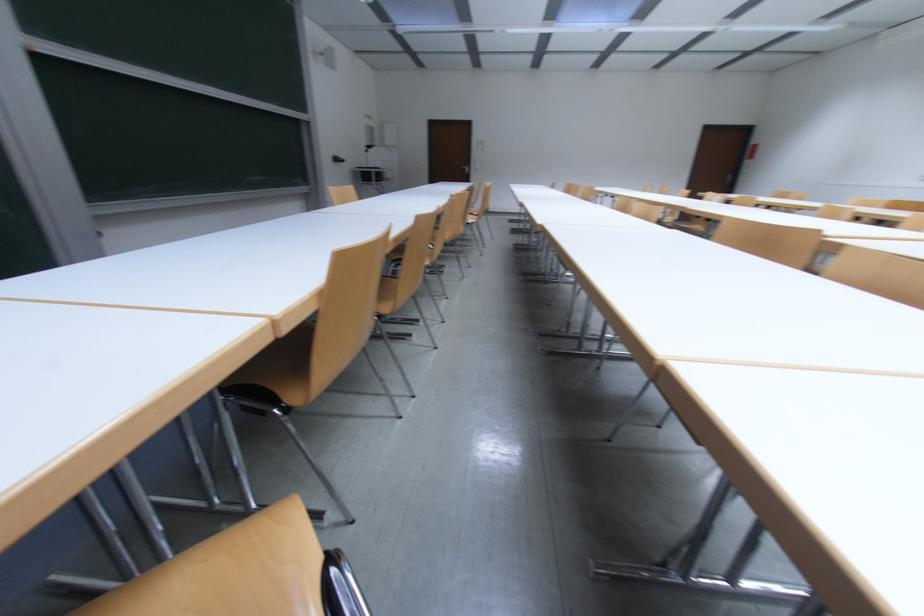
The image size is (924, 616). What do you see at coordinates (731, 177) in the screenshot?
I see `a silver door handle` at bounding box center [731, 177].